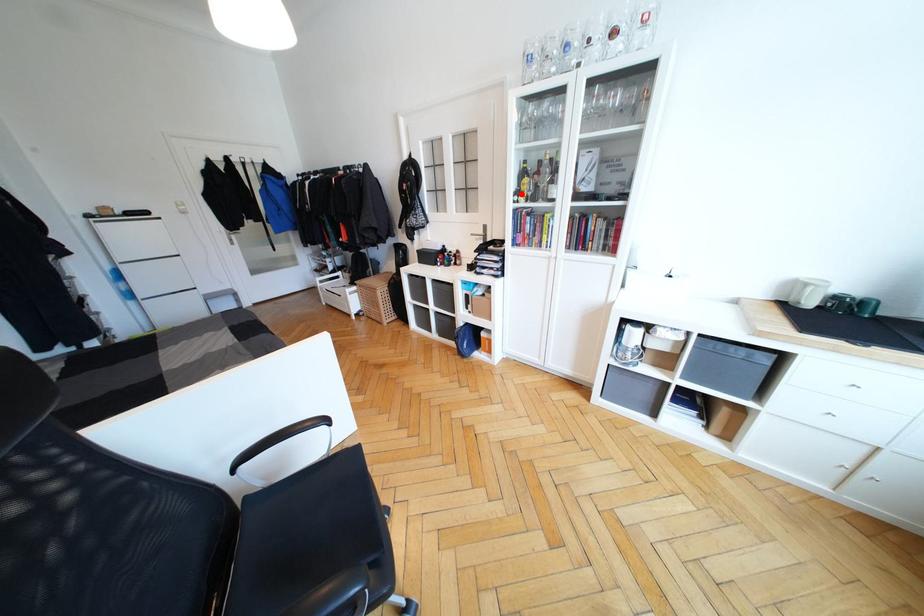
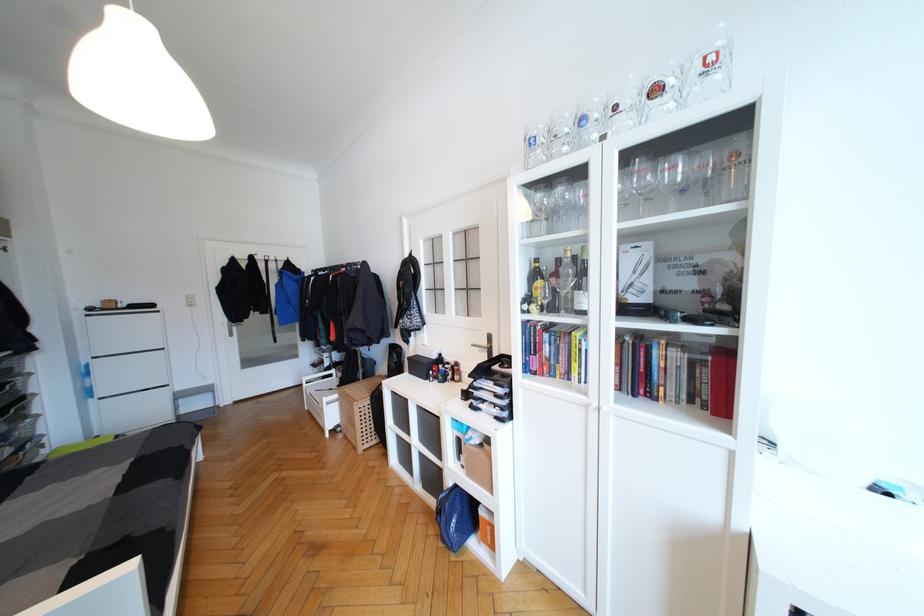
Question: I am providing you with two images of the same scene from different viewpoints. A red point is shown in image1. For the corresponding object point in image2, is it positioned nearer or farther from the camera?

Choices:
 (A) Nearer
 (B) Farther

Answer: (B)